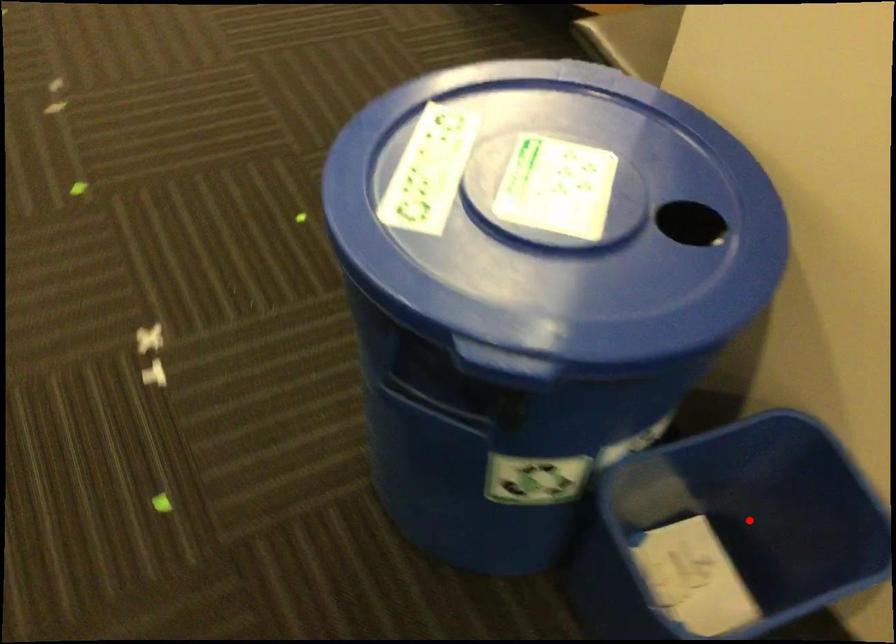
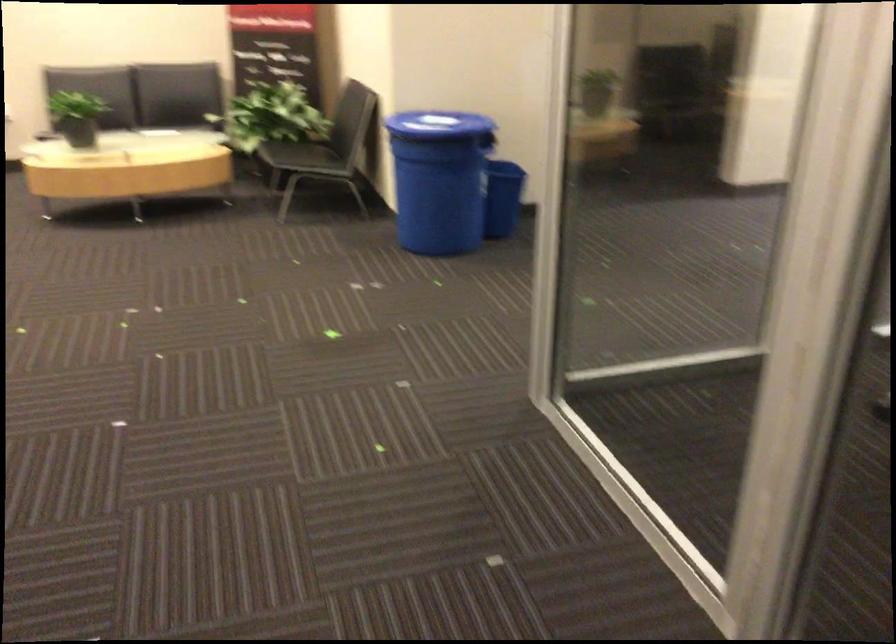
Question: I am providing you with two images of the same scene from different viewpoints. A red point is marked on the first image. At the location where the point appears in image 1, is it still visible in image 2?

Choices:
 (A) Yes
 (B) No

Answer: (B)